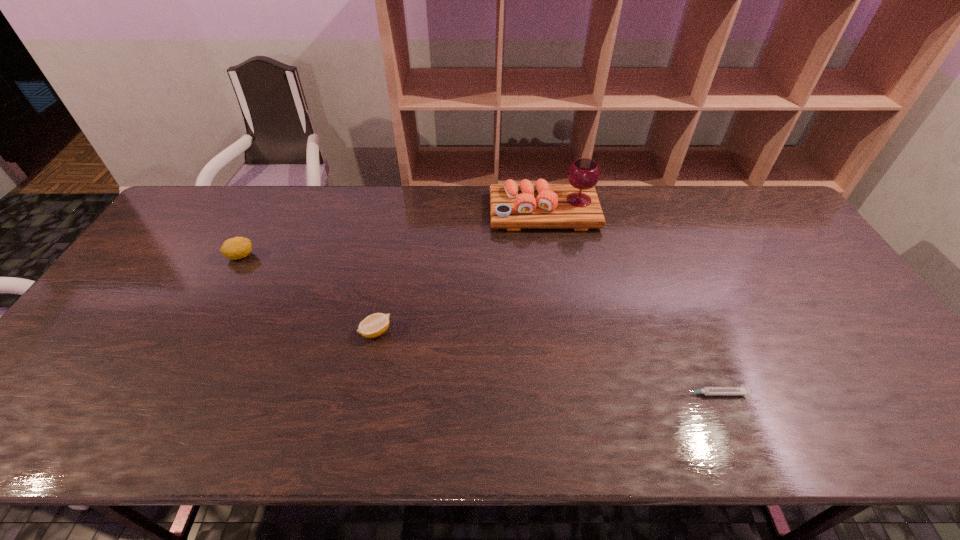
Locate an element on the screen. The image size is (960, 540). the tallest object is located at coordinates [576, 205].

You are a GUI agent. You are given a task and a screenshot of the screen. Output one action in this format:
    pyautogui.click(x=<x>, y=<y>)
    Task: Click on the platter
    
    Given the screenshot: What is the action you would take?
    pyautogui.click(x=576, y=205)

The image size is (960, 540). I want to click on the left lemon, so click(235, 248).

The width and height of the screenshot is (960, 540). Identify the location of the leftmost object. (235, 248).

The height and width of the screenshot is (540, 960). I want to click on the shorter lemon, so click(x=374, y=325).

Find the location of a particular element. the second object from left to right is located at coordinates (374, 325).

The image size is (960, 540). I want to click on the rightmost object, so click(x=741, y=390).

You are a GUI agent. You are given a task and a screenshot of the screen. Output one action in this format:
    pyautogui.click(x=<x>, y=<y>)
    Task: Click on the syringe
    The image size is (960, 540).
    Given the screenshot: What is the action you would take?
    741,390

This screenshot has height=540, width=960. I want to click on vacant space located on the left of the second object from right to left, so click(431, 212).

Find the location of `vacant region located at the stem end of the leftmost object`. vacant region located at the stem end of the leftmost object is located at coordinates (324, 256).